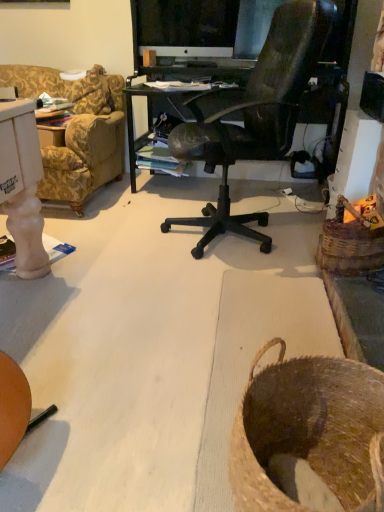
Question: From a real-world perspective, is woven brown basket at right, positioned as the 2th basket in bottom-to-top order, located beneath white glossy computer monitor at upper center?

Choices:
 (A) yes
 (B) no

Answer: (A)

Question: From a real-world perspective, is woven brown basket at right, which is counted as the first basket, starting from the right, physically above white glossy computer monitor at upper center?

Choices:
 (A) yes
 (B) no

Answer: (B)

Question: Is woven brown basket at right, positioned as the 2th basket in bottom-to-top order, behind white glossy computer monitor at upper center?

Choices:
 (A) yes
 (B) no

Answer: (B)

Question: Is woven brown basket at right, which appears as the 2th basket when viewed from the front, far away from white glossy computer monitor at upper center?

Choices:
 (A) no
 (B) yes

Answer: (B)

Question: Considering the relative sizes of woven brown basket at right, which is counted as the second basket, starting from the left, and white glossy computer monitor at upper center in the image provided, is woven brown basket at right, which is counted as the second basket, starting from the left, wider than white glossy computer monitor at upper center?

Choices:
 (A) yes
 (B) no

Answer: (A)

Question: Does woven brown basket at right, positioned as the 2th basket in bottom-to-top order, have a smaller size compared to white glossy computer monitor at upper center?

Choices:
 (A) yes
 (B) no

Answer: (A)

Question: Can you confirm if white glossy computer monitor at upper center is smaller than woven brown basket at right, the 1th basket from the top?

Choices:
 (A) no
 (B) yes

Answer: (A)

Question: Is white glossy computer monitor at upper center at the left side of woven brown basket at right, which appears as the 2th basket when viewed from the front?

Choices:
 (A) no
 (B) yes

Answer: (B)

Question: From a real-world perspective, is white glossy computer monitor at upper center physically above woven brown basket at right, positioned as the 2th basket in bottom-to-top order?

Choices:
 (A) yes
 (B) no

Answer: (A)

Question: From a real-world perspective, does white glossy computer monitor at upper center sit lower than woven brown basket at right, the first basket viewed from the back?

Choices:
 (A) yes
 (B) no

Answer: (B)

Question: Is white glossy computer monitor at upper center bigger than woven brown basket at right, which appears as the 2th basket when viewed from the front?

Choices:
 (A) no
 (B) yes

Answer: (B)

Question: Is white glossy computer monitor at upper center taller than woven brown basket at right, the 1th basket from the top?

Choices:
 (A) no
 (B) yes

Answer: (B)

Question: From a real-world perspective, is white glossy computer monitor at upper center physically below brown woven basket at lower right, marked as the 1th basket in a bottom-to-top arrangement?

Choices:
 (A) no
 (B) yes

Answer: (A)